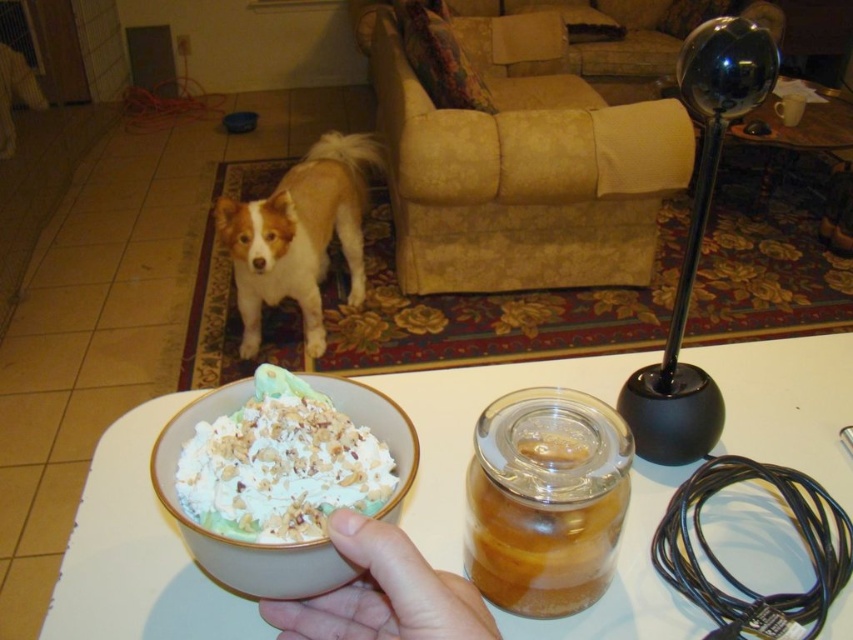
Question: Can you confirm if transparent glass jar at center is positioned to the left of white textured bowl at lower left?

Choices:
 (A) no
 (B) yes

Answer: (A)

Question: Based on their relative distances, which object is nearer to the transparent glass jar at center?

Choices:
 (A) flesh-toned skin at center
 (B) brown/white fur dog at center

Answer: (A)

Question: Which point is farther from the camera taking this photo?

Choices:
 (A) (607, 456)
 (B) (129, 547)
 (C) (241, 392)
 (D) (496, 627)

Answer: (B)

Question: Among these points, which one is nearest to the camera?

Choices:
 (A) (546, 627)
 (B) (540, 465)
 (C) (212, 397)

Answer: (B)

Question: Is transparent glass jar at center closer to the viewer compared to brown/white fur dog at center?

Choices:
 (A) no
 (B) yes

Answer: (B)

Question: Is white ceramic bowl at center to the right of flesh-toned skin at center from the viewer's perspective?

Choices:
 (A) no
 (B) yes

Answer: (B)